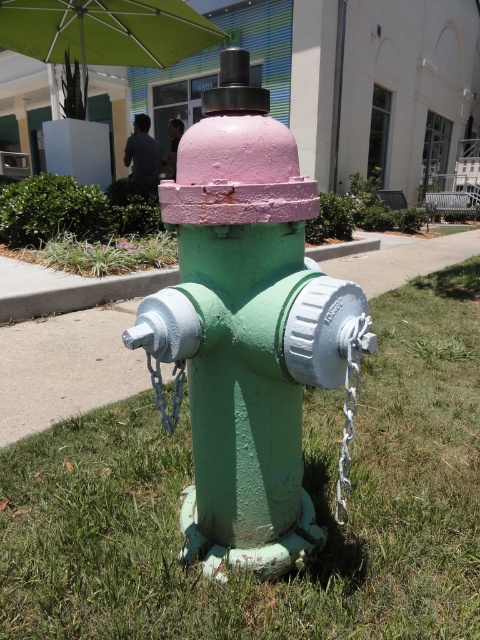
Question: Which of the following is the farthest from the observer?

Choices:
 (A) (144, 276)
 (B) (214, 260)

Answer: (A)

Question: Does green fabric umbrella at upper center appear over metallic chain at center?

Choices:
 (A) no
 (B) yes

Answer: (B)

Question: Can you confirm if green fabric umbrella at upper center is positioned to the left of silver metallic chain at lower center?

Choices:
 (A) no
 (B) yes

Answer: (B)

Question: Based on their relative distances, which object is farther from the green painted concrete curb at lower center?

Choices:
 (A) green fabric umbrella at upper center
 (B) green matte grass at lower center
 (C) pink matte fire hydrant at center
 (D) metallic chain at center

Answer: (D)

Question: Considering the relative positions of silver metallic chain at lower center and metallic chain at center in the image provided, where is silver metallic chain at lower center located with respect to metallic chain at center?

Choices:
 (A) above
 (B) below

Answer: (B)

Question: Which object appears closest to the camera in this image?

Choices:
 (A) green fabric umbrella at upper center
 (B) silver metallic chain at lower center
 (C) pink matte fire hydrant at center
 (D) metallic chain at center

Answer: (B)